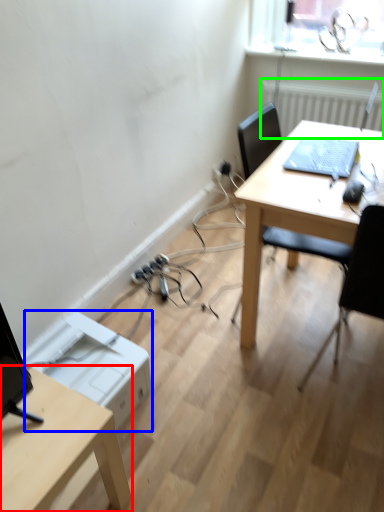
Question: Based on their relative distances, which object is farther from desk (highlighted by a red box)? Choose from printer (highlighted by a blue box) and radiator (highlighted by a green box).

Choices:
 (A) printer
 (B) radiator

Answer: (B)